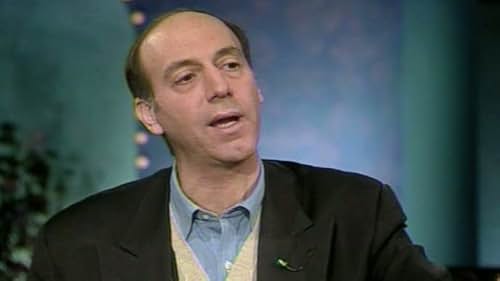
Find the location of `wall`. wall is located at coordinates (312, 85).